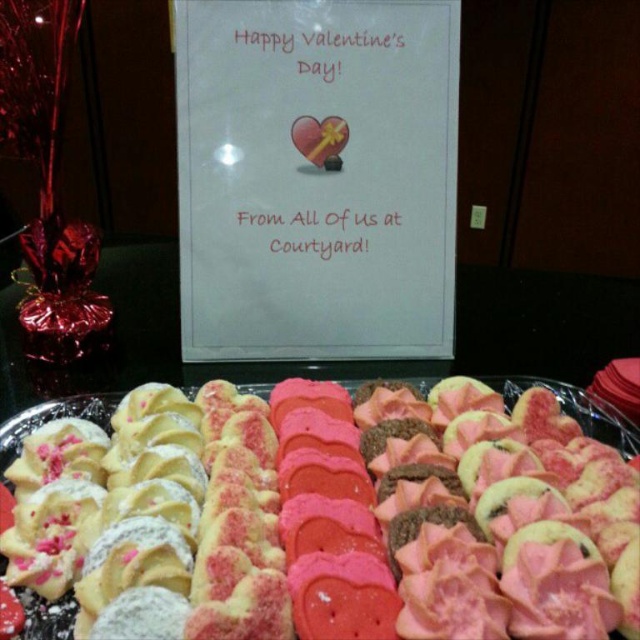
Question: Which point is farther from the camera taking this photo?

Choices:
 (A) (426, 321)
 (B) (113, 404)

Answer: (A)

Question: Does white paper sign at upper center come in front of pink frosted heart-shaped cookies at center?

Choices:
 (A) no
 (B) yes

Answer: (A)

Question: Observing the image, what is the correct spatial positioning of white paper sign at upper center in reference to pink frosted heart-shaped cookies at center?

Choices:
 (A) left
 (B) right

Answer: (A)

Question: Where is white paper sign at upper center located in relation to pink frosted heart-shaped cookies at center in the image?

Choices:
 (A) left
 (B) right

Answer: (A)

Question: Which point is farther to the camera?

Choices:
 (A) (429, 176)
 (B) (577, 408)

Answer: (A)

Question: Which of the following is the closest to the observer?

Choices:
 (A) pink frosted heart-shaped cookies at center
 (B) white paper sign at upper center

Answer: (A)